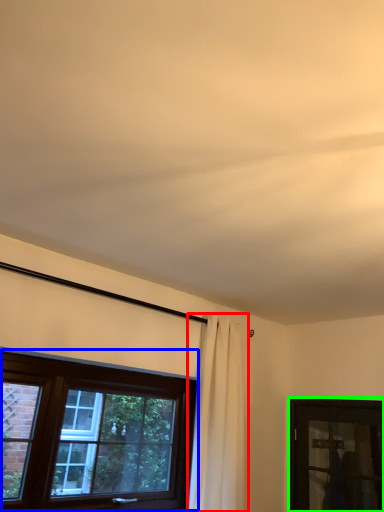
Question: Estimate the real-world distances between objects in this image. Which object is farther from curtain (highlighted by a red box), window (highlighted by a blue box) or window (highlighted by a green box)?

Choices:
 (A) window
 (B) window

Answer: (B)